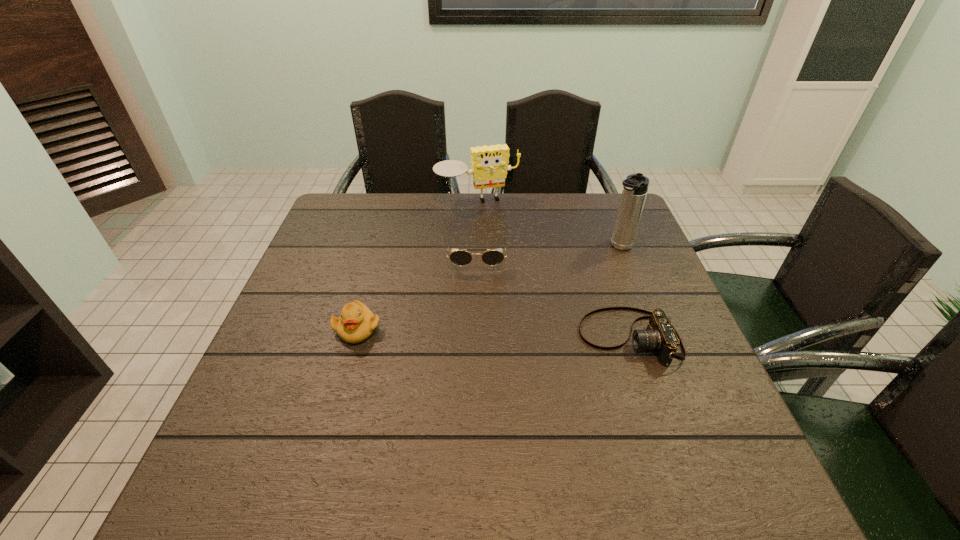
Where is `object present at the left edge`? The height and width of the screenshot is (540, 960). object present at the left edge is located at coordinates (356, 323).

Where is `camera that is positioned at the right edge`? This screenshot has height=540, width=960. camera that is positioned at the right edge is located at coordinates (660, 335).

You are a GUI agent. You are given a task and a screenshot of the screen. Output one action in this format:
    pyautogui.click(x=<x>, y=<y>)
    Task: Click on the thermos bottle situated at the right edge
    The image size is (960, 540).
    Given the screenshot: What is the action you would take?
    pyautogui.click(x=635, y=186)

Identify the location of free region at the far edge of the desktop. (527, 196).

At what (x,y) coordinates should I click in order to perform the action: click on free space at the near edge of the desktop. Please return your answer as a coordinate pair (x, y). This screenshot has height=540, width=960. Looking at the image, I should click on (397, 438).

The width and height of the screenshot is (960, 540). In order to click on vacant point at the left edge in this screenshot , I will do pos(324,286).

This screenshot has width=960, height=540. In order to click on free point at the right edge in this screenshot , I will do `click(608, 250)`.

Identify the location of vacant area at the far right corner of the desktop. This screenshot has height=540, width=960. (642, 228).

At what (x,y) coordinates should I click in order to perform the action: click on vacant area that lies between the second tallest object and the thermos bottle. Please return your answer as a coordinate pair (x, y). The height and width of the screenshot is (540, 960). Looking at the image, I should click on (548, 225).

At what (x,y) coordinates should I click in order to perform the action: click on vacant space in between the second tallest object and the sunglasses. Please return your answer as a coordinate pair (x, y). Image resolution: width=960 pixels, height=540 pixels. Looking at the image, I should click on (477, 230).